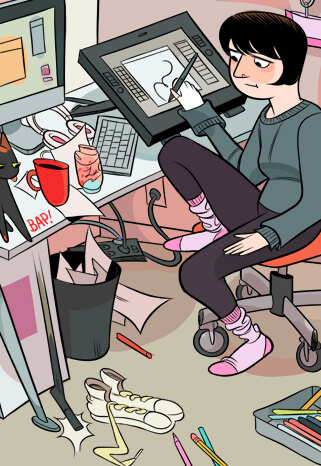
Where is `desk`? desk is located at coordinates (115, 185).